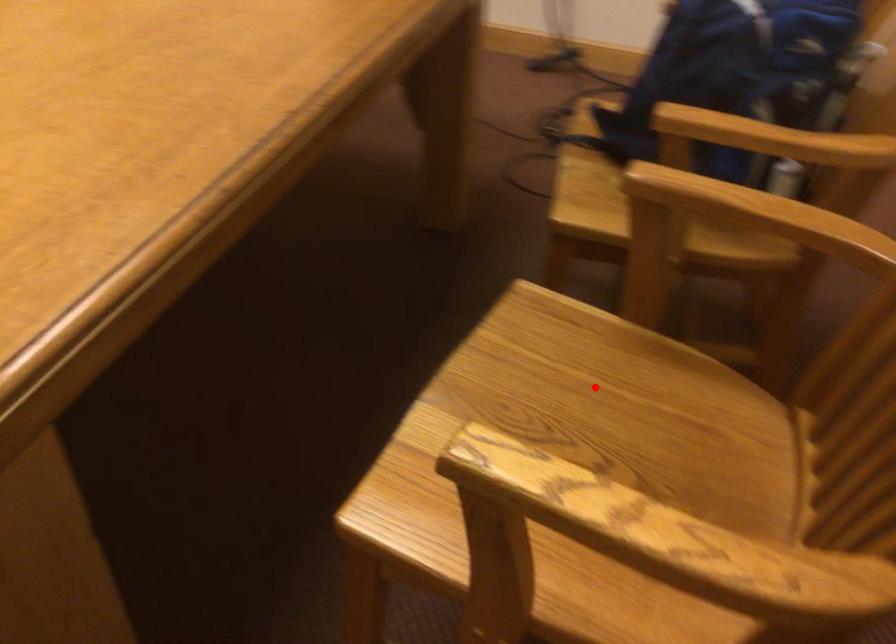
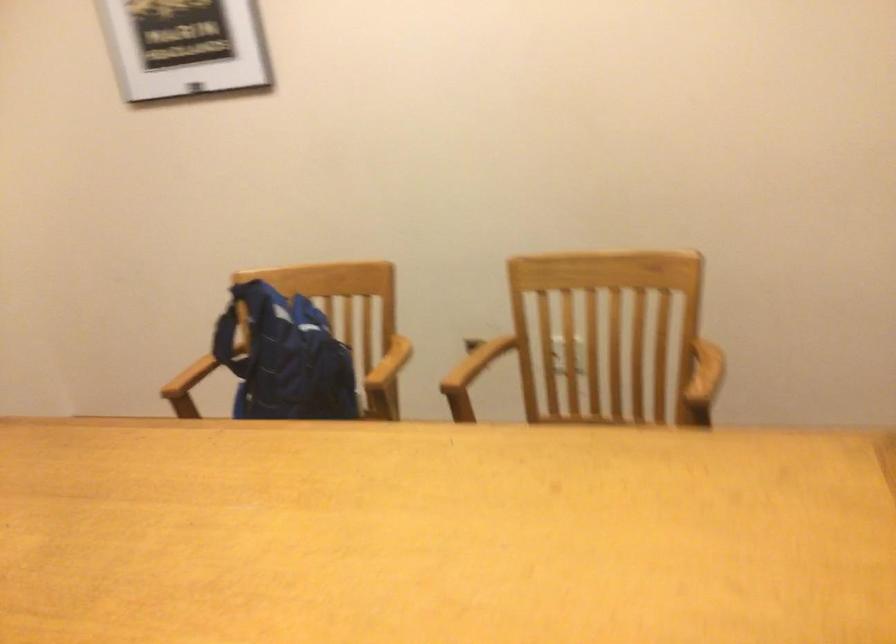
Question: I am providing you with two images of the same scene from different viewpoints. A red point is marked on the first image. Is the red point's position out of view in image 2?

Choices:
 (A) Yes
 (B) No

Answer: (A)